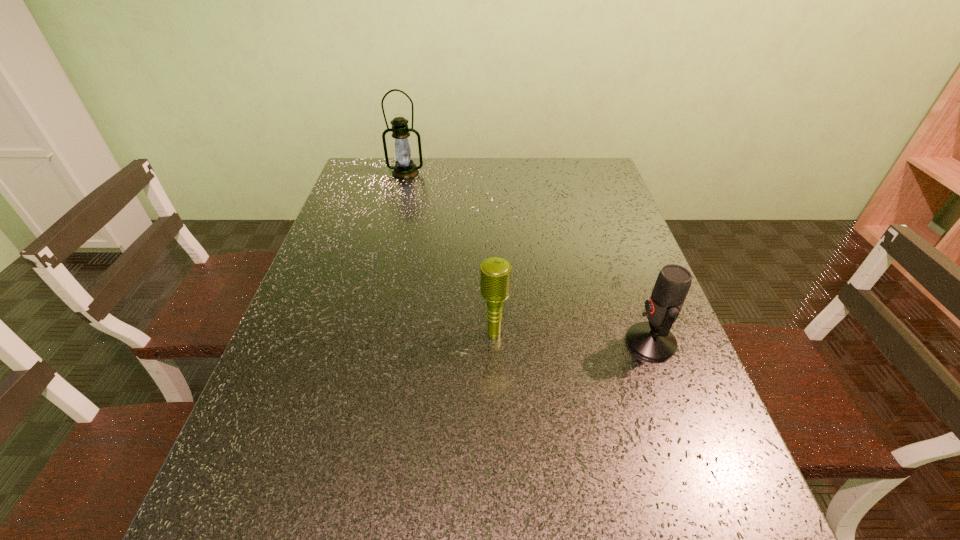
I want to click on the leftmost object, so click(x=404, y=168).

You are a GUI agent. You are given a task and a screenshot of the screen. Output one action in this format:
    pyautogui.click(x=<x>, y=<y>)
    Task: Click on the lantern
    
    Given the screenshot: What is the action you would take?
    pyautogui.click(x=404, y=168)

Locate an element on the screen. the rightmost object is located at coordinates (653, 341).

The height and width of the screenshot is (540, 960). What are the coordinates of `the left microphone` in the screenshot? It's located at point(495,272).

At what (x,y) coordinates should I click in order to perform the action: click on free space located 0.120m on the side where the leftmost object emits light. Please return your answer as a coordinate pair (x, y). Looking at the image, I should click on (398, 199).

Where is `free space located 0.270m on the side of the right microphone with the red ring`? Image resolution: width=960 pixels, height=540 pixels. free space located 0.270m on the side of the right microphone with the red ring is located at coordinates (501, 342).

Where is `vacant space located on the side of the right microphone with the red ring`? The height and width of the screenshot is (540, 960). vacant space located on the side of the right microphone with the red ring is located at coordinates (482, 342).

Where is `vacant space located on the side of the right microphone with the red ring`? The height and width of the screenshot is (540, 960). vacant space located on the side of the right microphone with the red ring is located at coordinates (603, 342).

Find the location of a particular element. This screenshot has width=960, height=540. vacant area situated 0.070m on the right of the left microphone is located at coordinates (540, 334).

You are a GUI agent. You are given a task and a screenshot of the screen. Output one action in this format:
    pyautogui.click(x=<x>, y=<y>)
    Task: Click on the object present at the far edge
    Image resolution: width=960 pixels, height=540 pixels.
    Given the screenshot: What is the action you would take?
    pyautogui.click(x=404, y=168)